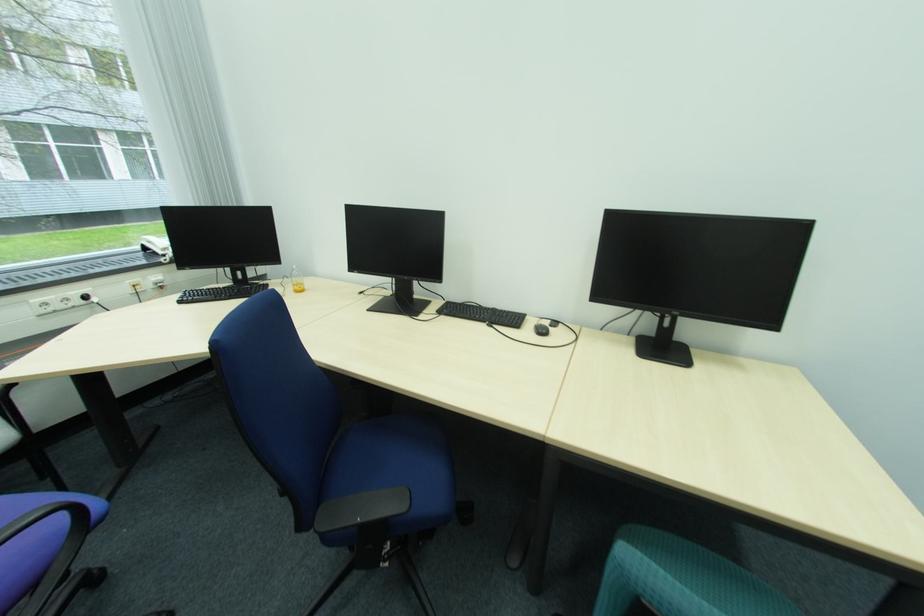
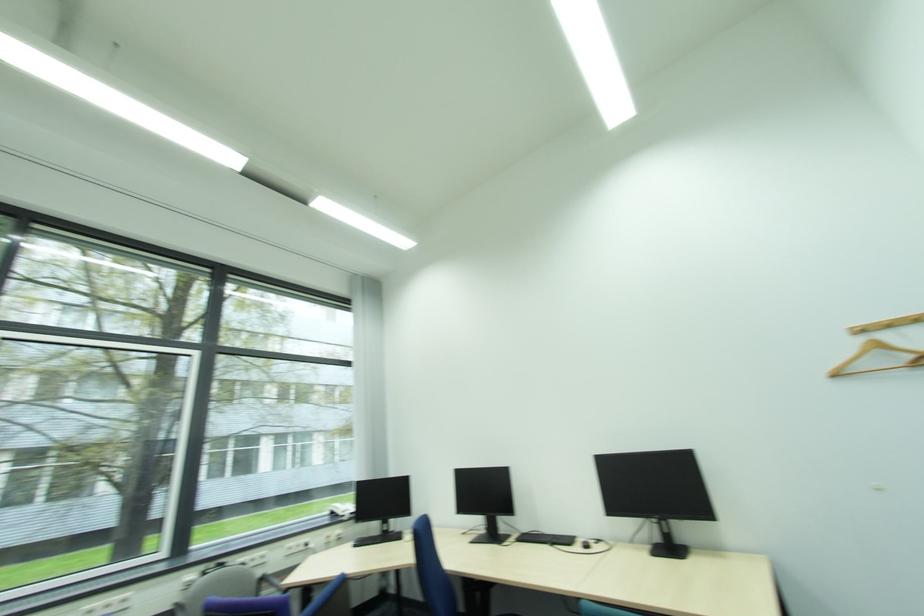
Locate, in the second image, the point that corresponds to pixel 74 301 in the first image.

(305, 546)